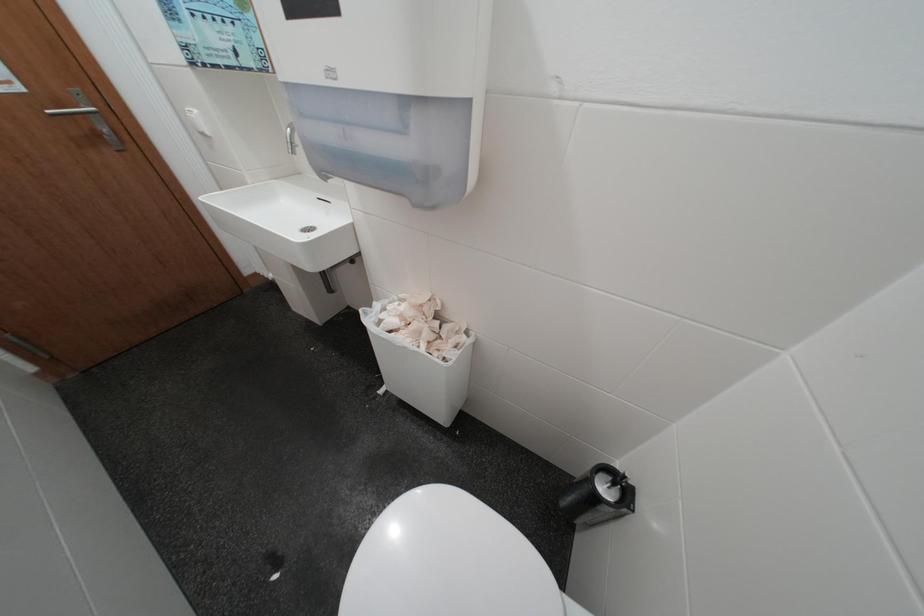
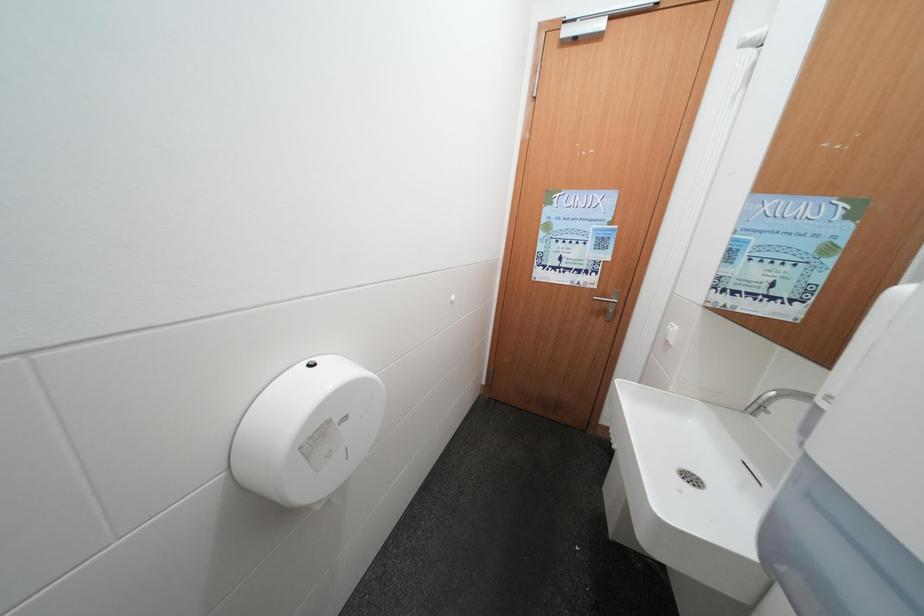
Question: How did the camera likely rotate?

Choices:
 (A) Left
 (B) Right
 (C) Up
 (D) Down

Answer: (A)